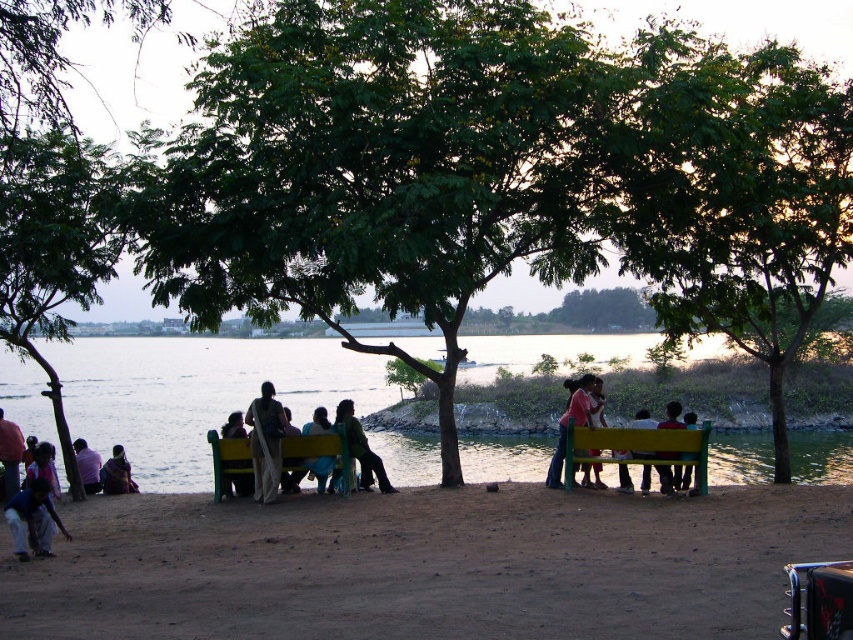
Question: Estimate the real-world distances between objects in this image. Which object is farther from the matte green bench at center?

Choices:
 (A) yellow painted wood bench at center
 (B) dark blue jeans at lower left
 (C) dark blue fabric shirt at lower left

Answer: (C)

Question: Does pink fabric dress at center have a larger size compared to matte green bench at center?

Choices:
 (A) no
 (B) yes

Answer: (A)

Question: Which of the following is the farthest from the observer?

Choices:
 (A) (41, 499)
 (B) (20, 458)
 (C) (664, 467)

Answer: (B)

Question: Estimate the real-world distances between objects in this image. Which object is closer to the green fabric bench at right?

Choices:
 (A) matte pink shirt at center
 (B) silhouette sari at center
 (C) green fabric bench at center
 (D) yellow painted wood bench at center

Answer: (D)

Question: Does silhouette sari at center have a larger size compared to dark blue fabric at lower left?

Choices:
 (A) yes
 (B) no

Answer: (A)

Question: Can you confirm if dark blue fabric dress at lower left is positioned to the left of dark blue fabric shirt at lower left?

Choices:
 (A) no
 (B) yes

Answer: (B)